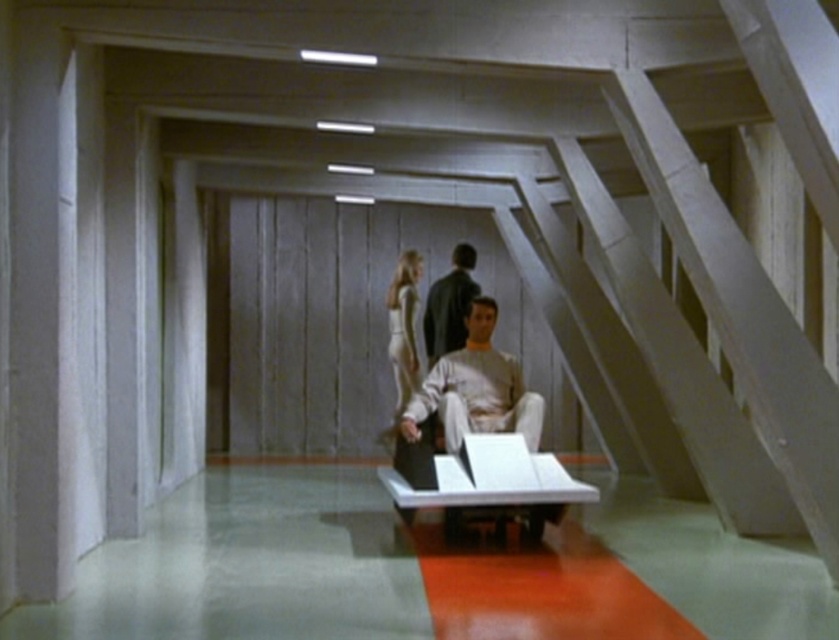
Does light beige fabric shirt at center appear under silvery metallic dress at center?

Correct, light beige fabric shirt at center is located below silvery metallic dress at center.

Can you confirm if light beige fabric shirt at center is positioned to the left of silvery metallic dress at center?

In fact, light beige fabric shirt at center is to the right of silvery metallic dress at center.

Who is more forward, (499,380) or (412,358)?

Positioned in front is point (499,380).

What are the coordinates of `light beige fabric shirt at center` in the screenshot? It's located at (475, 388).

Does light beige fabric shirt at center have a greater height compared to dark brown leather jacket at center?

In fact, light beige fabric shirt at center may be shorter than dark brown leather jacket at center.

Measure the distance between light beige fabric shirt at center and camera.

The distance of light beige fabric shirt at center from camera is 19.48 feet.

Is point (470, 424) behind point (464, 324)?

No, (470, 424) is in front of (464, 324).

Find the location of a particular element. light beige fabric shirt at center is located at coordinates click(475, 388).

Can you confirm if dark brown leather jacket at center is positioned to the left of silvery metallic dress at center?

In fact, dark brown leather jacket at center is to the right of silvery metallic dress at center.

Based on the photo, does dark brown leather jacket at center appear on the right side of silvery metallic dress at center?

Indeed, dark brown leather jacket at center is positioned on the right side of silvery metallic dress at center.

Locate an element on the screen. The image size is (839, 640). dark brown leather jacket at center is located at coordinates (449, 305).